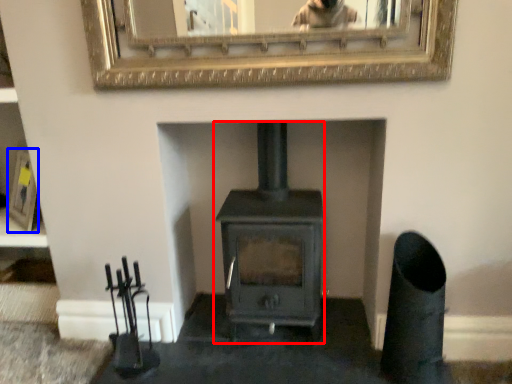
Question: Among these objects, which one is nearest to the camera, wood burning stove (highlighted by a red box) or picture frame (highlighted by a blue box)?

Choices:
 (A) wood burning stove
 (B) picture frame

Answer: (A)